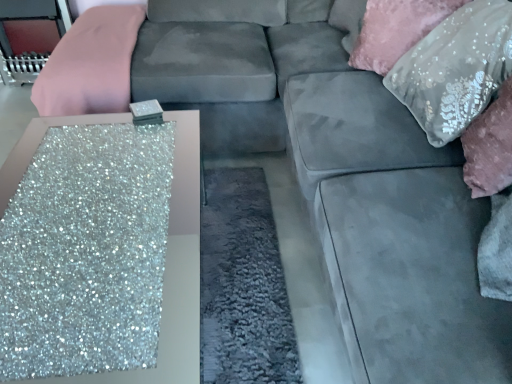
Question: Does satin silver pillow at upper right, positioned as the 1th pillow in front-to-back order, have a lesser width compared to sequined fabric pillow at upper right, arranged as the 1th pillow when viewed from the back?

Choices:
 (A) yes
 (B) no

Answer: (B)

Question: Is satin silver pillow at upper right, the 2th pillow when ordered from back to front, next to sequined fabric pillow at upper right, arranged as the 1th pillow when viewed from the back, and touching it?

Choices:
 (A) no
 (B) yes

Answer: (A)

Question: From the image's perspective, would you say satin silver pillow at upper right, the 2th pillow when ordered from back to front, is positioned over sequined fabric pillow at upper right, arranged as the 1th pillow when viewed from the back?

Choices:
 (A) no
 (B) yes

Answer: (A)

Question: Could you tell me if satin silver pillow at upper right, the 2th pillow when ordered from back to front, is facing sequined fabric pillow at upper right, arranged as the 1th pillow when viewed from the back?

Choices:
 (A) yes
 (B) no

Answer: (B)

Question: Is satin silver pillow at upper right, the 2th pillow when ordered from back to front, completely or partially outside of sequined fabric pillow at upper right, acting as the 2th pillow starting from the front?

Choices:
 (A) yes
 (B) no

Answer: (A)

Question: Is satin silver pillow at upper right, positioned as the 1th pillow in front-to-back order, positioned before sequined fabric pillow at upper right, arranged as the 1th pillow when viewed from the back?

Choices:
 (A) yes
 (B) no

Answer: (A)

Question: Is satin silver pillow at upper right, the 2th pillow when ordered from back to front, to the left of glittery silver table at lower left from the viewer's perspective?

Choices:
 (A) yes
 (B) no

Answer: (B)

Question: Can you confirm if satin silver pillow at upper right, positioned as the 1th pillow in front-to-back order, is shorter than glittery silver table at lower left?

Choices:
 (A) no
 (B) yes

Answer: (A)

Question: Does satin silver pillow at upper right, positioned as the 1th pillow in front-to-back order, come behind glittery silver table at lower left?

Choices:
 (A) yes
 (B) no

Answer: (A)

Question: Considering the relative sizes of satin silver pillow at upper right, positioned as the 1th pillow in front-to-back order, and glittery silver table at lower left in the image provided, is satin silver pillow at upper right, positioned as the 1th pillow in front-to-back order, wider than glittery silver table at lower left?

Choices:
 (A) no
 (B) yes

Answer: (A)

Question: From a real-world perspective, is satin silver pillow at upper right, positioned as the 1th pillow in front-to-back order, physically below glittery silver table at lower left?

Choices:
 (A) no
 (B) yes

Answer: (A)

Question: Is satin silver pillow at upper right, positioned as the 1th pillow in front-to-back order, positioned beyond the bounds of glittery silver table at lower left?

Choices:
 (A) no
 (B) yes

Answer: (B)

Question: Considering the relative sizes of sequined fabric pillow at upper right, acting as the 2th pillow starting from the front, and satin silver pillow at upper right, the 2th pillow when ordered from back to front, in the image provided, is sequined fabric pillow at upper right, acting as the 2th pillow starting from the front, taller than satin silver pillow at upper right, the 2th pillow when ordered from back to front,?

Choices:
 (A) yes
 (B) no

Answer: (B)